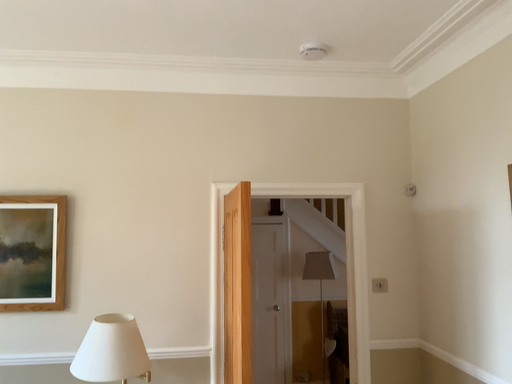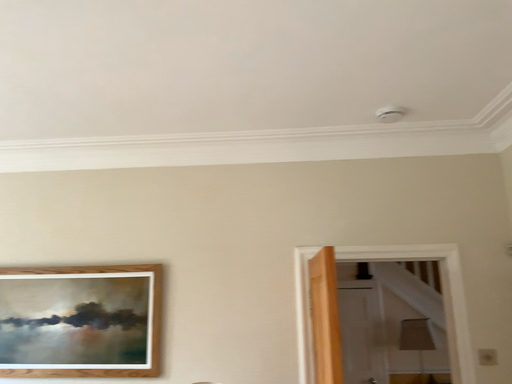
Question: Which way did the camera rotate in the video?

Choices:
 (A) rotated upward
 (B) rotated downward

Answer: (A)